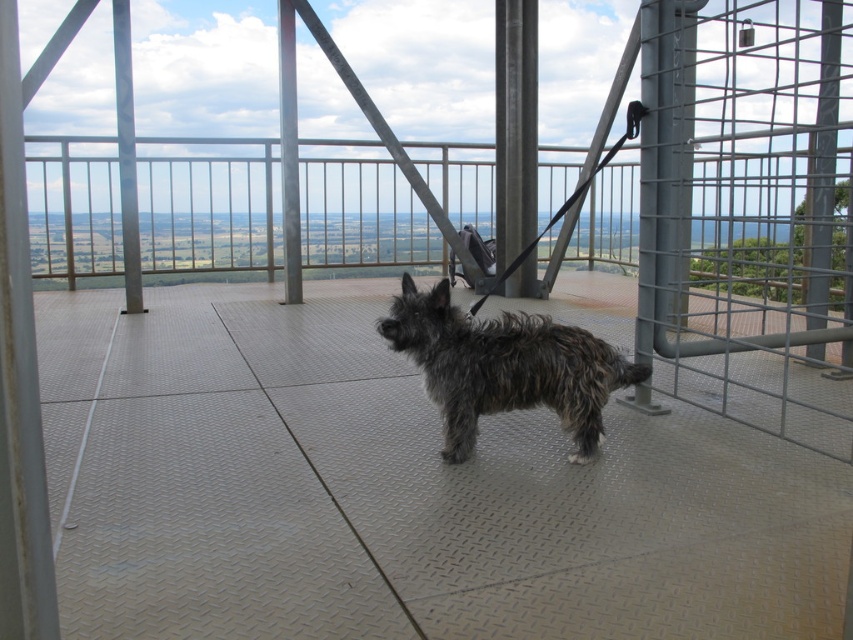
Who is shorter, metallic grid gate at right or fuzzy brown dog at center?

With less height is fuzzy brown dog at center.

Where is `metallic grid gate at right`? This screenshot has width=853, height=640. metallic grid gate at right is located at coordinates (747, 212).